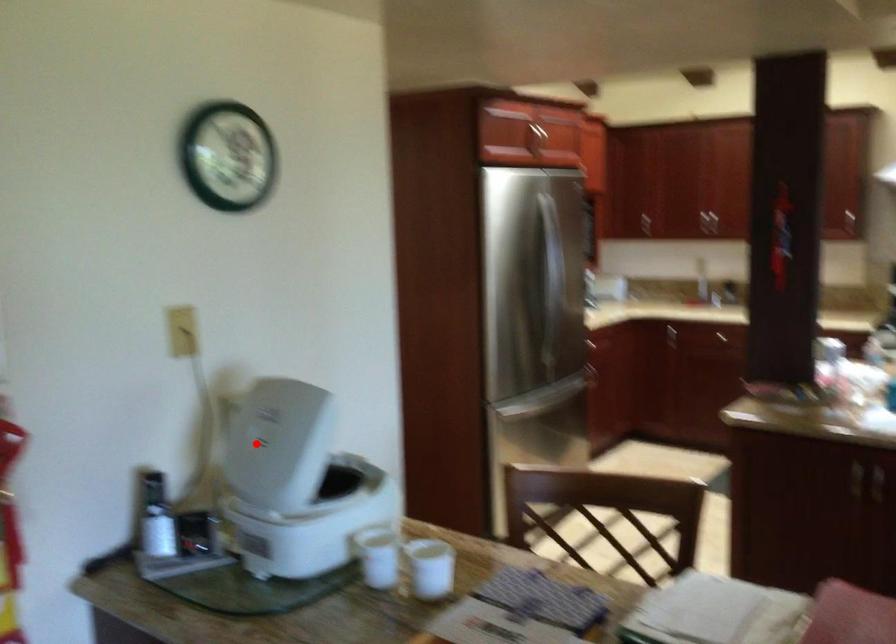
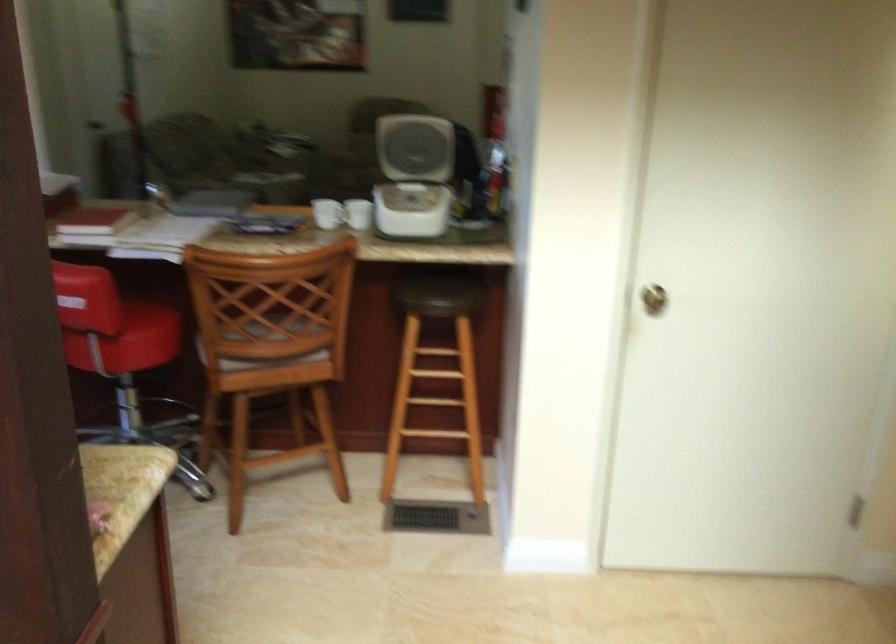
Question: I am providing you with two images of the same scene from different viewpoints. A red point is marked on the first image. Can you still see the location of the red point in image 2?

Choices:
 (A) Yes
 (B) No

Answer: (A)